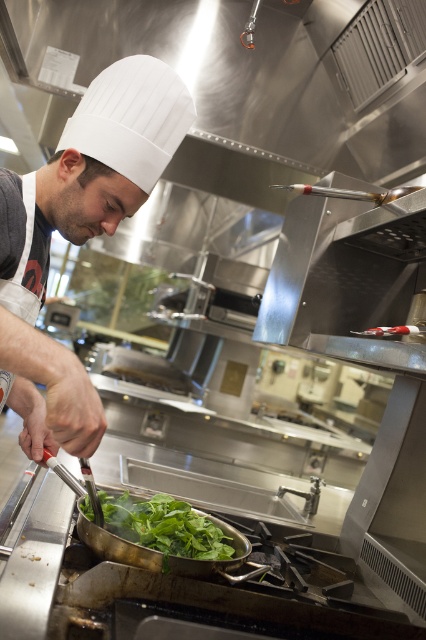
Question: Can you confirm if white matte chef hat at upper left is positioned above green leafy vegetable at center?

Choices:
 (A) no
 (B) yes

Answer: (B)

Question: Which point is closer to the camera taking this photo?

Choices:
 (A) (189, 536)
 (B) (3, 214)

Answer: (B)

Question: Can you confirm if white matte chef hat at upper left is positioned to the left of green leafy vegetable at center?

Choices:
 (A) yes
 (B) no

Answer: (A)

Question: Does white matte chef hat at upper left appear under green leafy vegetable at center?

Choices:
 (A) no
 (B) yes

Answer: (A)